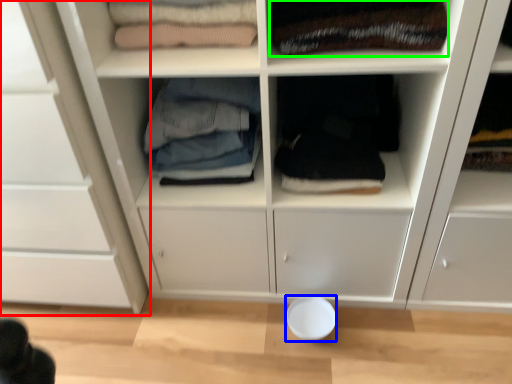
Question: Which object is the closest to the cupboard (highlighted by a red box)? Choose among these: bowl (highlighted by a blue box) or clothing (highlighted by a green box).

Choices:
 (A) bowl
 (B) clothing

Answer: (B)